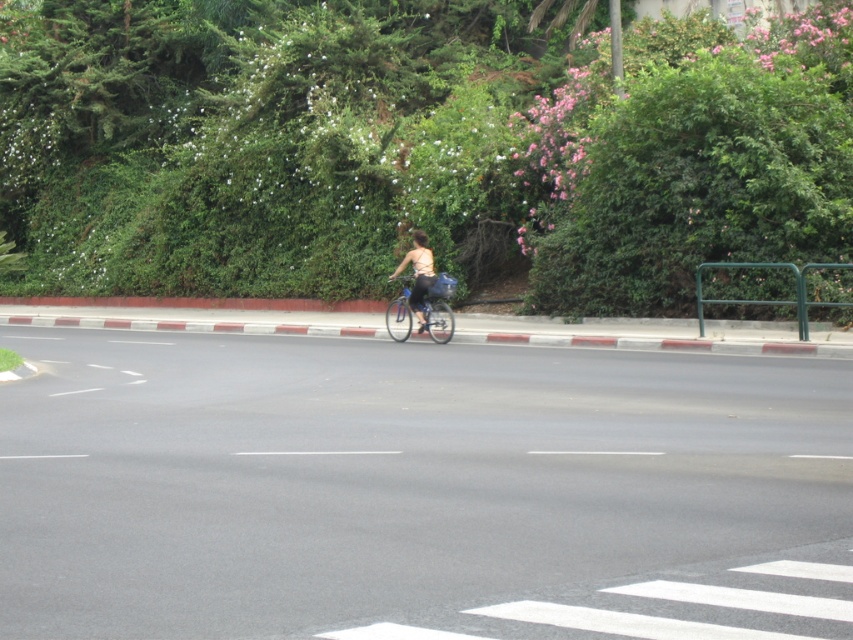
Question: Which point is farther from the camera taking this photo?

Choices:
 (A) (428, 256)
 (B) (434, 292)

Answer: (A)

Question: Among these points, which one is nearest to the camera?

Choices:
 (A) (387, 278)
 (B) (437, 342)

Answer: (B)

Question: Can you confirm if shiny metallic bicycle at center is wider than matte beige tank top at center?

Choices:
 (A) yes
 (B) no

Answer: (B)

Question: Is shiny metallic bicycle at center further to the viewer compared to matte beige tank top at center?

Choices:
 (A) no
 (B) yes

Answer: (B)

Question: Does shiny metallic bicycle at center appear over matte beige tank top at center?

Choices:
 (A) no
 (B) yes

Answer: (A)